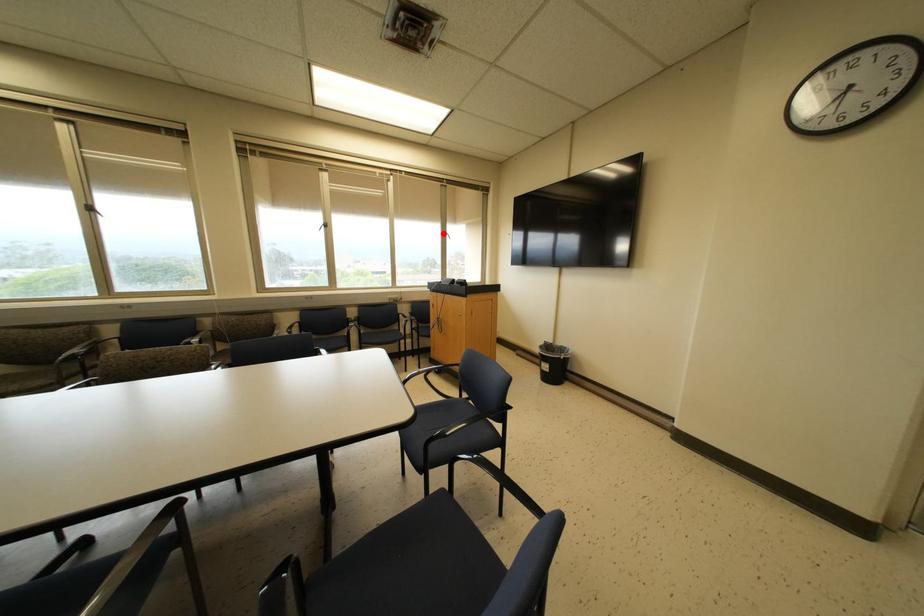
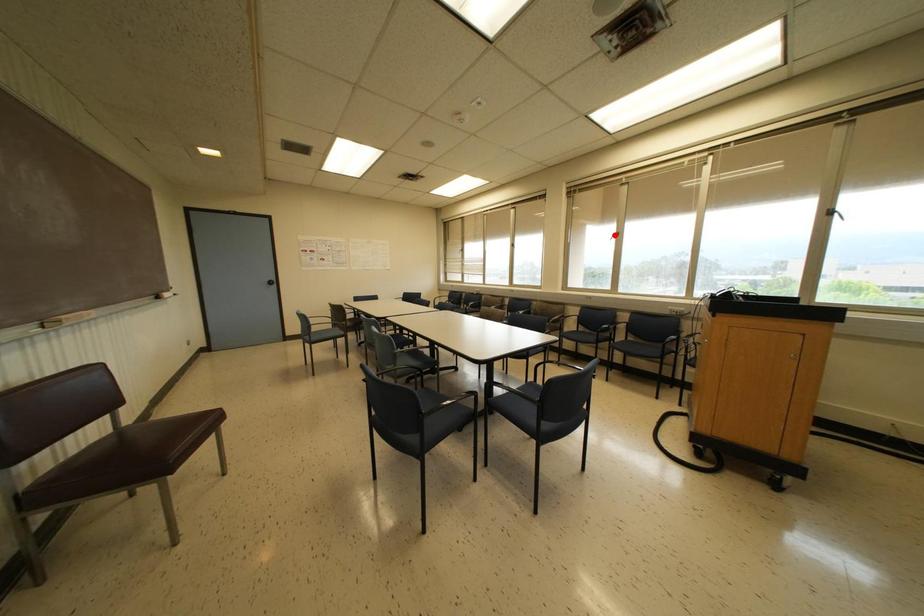
I am providing you with two images of the same scene from different viewpoints. A red point is marked on the first image and another point is marked on the second image. Do the highlighted points in image1 and image2 indicate the same real-world spot?

No